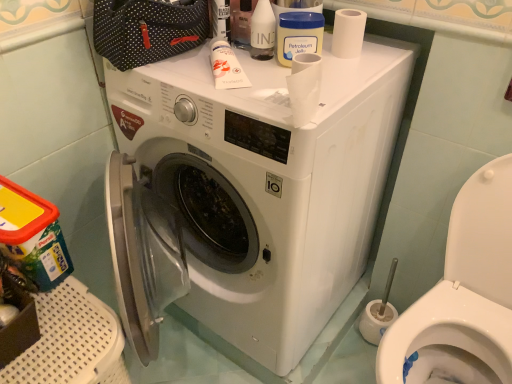
You are a GUI agent. You are given a task and a screenshot of the screen. Output one action in this format:
    pyautogui.click(x=<x>, y=<y>)
    Task: Click on the white plastic washing machine at center
    The height and width of the screenshot is (384, 512).
    Given the screenshot: What is the action you would take?
    pyautogui.click(x=267, y=184)

I want to click on white plastic washing machine at center, so click(x=267, y=184).

From the image's perspective, is white matte tube at upper center, the 2th toiletry when ordered from top to bottom, located above or below white glossy toilet at lower right?

white matte tube at upper center, the 2th toiletry when ordered from top to bottom, is situated higher than white glossy toilet at lower right in the image.

Would you consider white matte tube at upper center, which is the first toiletry from left to right, to be distant from white glossy toilet at lower right?

white matte tube at upper center, which is the first toiletry from left to right, is near white glossy toilet at lower right, not far away.

Looking at this image, from a real-world perspective, which is physically below, white matte tube at upper center, which is the 2th toiletry from right to left, or white glossy toilet at lower right?

From a 3D spatial view, white glossy toilet at lower right is below.

Considering the relative positions of white matte tube at upper center, which is the 2th toiletry from right to left, and white glossy toilet at lower right in the image provided, is white matte tube at upper center, which is the 2th toiletry from right to left, to the right of white glossy toilet at lower right from the viewer's perspective?

No.

Is point (356, 190) closer or farther from the camera than point (221, 61)?

Point (356, 190) is farther from the camera than point (221, 61).

From the picture: Is white plastic washing machine at center turned away from white matte tube at upper center, the 2th toiletry when ordered from top to bottom?

No, white plastic washing machine at center's orientation is not away from white matte tube at upper center, the 2th toiletry when ordered from top to bottom.

From their relative heights in the image, would you say white plastic washing machine at center is taller or shorter than white matte toilet paper at upper right?

In the image, white plastic washing machine at center appears to be taller than white matte toilet paper at upper right.

From a real-world perspective, relative to white matte toilet paper at upper right, is white plastic washing machine at center vertically above or below?

white plastic washing machine at center is below white matte toilet paper at upper right.

From the image's perspective, is white plastic washing machine at center over white matte toilet paper at upper right?

No, from the image's perspective, white plastic washing machine at center is not on top of white matte toilet paper at upper right.

Are white plastic washing machine at center and white matte toilet paper at upper right making contact?

white plastic washing machine at center and white matte toilet paper at upper right are not in contact.

Is point (323, 41) positioned before point (482, 364)?

Yes, point (323, 41) is closer to viewer.

Measure the distance between white plastic washing machine at center and white glossy toilet at lower right.

white plastic washing machine at center and white glossy toilet at lower right are 16.26 inches apart.

Considering the sizes of objects white plastic washing machine at center and white glossy toilet at lower right in the image provided, who is thinner, white plastic washing machine at center or white glossy toilet at lower right?

With smaller width is white glossy toilet at lower right.

Is white plastic washing machine at center spatially inside white glossy toilet at lower right, or outside of it?

white plastic washing machine at center is not enclosed by white glossy toilet at lower right.

Can you see white matte toilet paper at upper right touching white matte tube at upper center, which is the first toiletry from left to right?

No, white matte toilet paper at upper right is not making contact with white matte tube at upper center, which is the first toiletry from left to right.

Which object is more forward, white matte toilet paper at upper right or white matte tube at upper center, the 1th toiletry ordered from the bottom?

white matte tube at upper center, the 1th toiletry ordered from the bottom, is more forward.

From a real-world perspective, who is located higher, white matte toilet paper at upper right or white matte tube at upper center, the 1th toiletry ordered from the bottom?

white matte toilet paper at upper right.

Is white matte toilet paper at upper right oriented away from white matte tube at upper center, the 2th toiletry when ordered from top to bottom?

No, white matte tube at upper center, the 2th toiletry when ordered from top to bottom, is not at the back of white matte toilet paper at upper right.

Between white matte tube at upper center, the 2th toiletry when ordered from top to bottom, and translucent plastic bottle at upper center, which ranks as the first toiletry in right-to-left order, which one has smaller width?

Thinner between the two is translucent plastic bottle at upper center, which ranks as the first toiletry in right-to-left order.

From the image's perspective, who appears lower, white matte tube at upper center, which is the first toiletry from left to right, or translucent plastic bottle at upper center, which ranks as the first toiletry in right-to-left order?

From the image's view, white matte tube at upper center, which is the first toiletry from left to right, is below.

Is white matte tube at upper center, the 1th toiletry ordered from the bottom, at the right side of translucent plastic bottle at upper center, acting as the second toiletry starting from the left?

In fact, white matte tube at upper center, the 1th toiletry ordered from the bottom, is to the left of translucent plastic bottle at upper center, acting as the second toiletry starting from the left.

Measure the distance from white matte tube at upper center, which is the first toiletry from left to right, to translucent plastic bottle at upper center, which appears as the 1th toiletry when viewed from the top.

white matte tube at upper center, which is the first toiletry from left to right, is 4.35 inches from translucent plastic bottle at upper center, which appears as the 1th toiletry when viewed from the top.

Is translucent plastic bottle at upper center, the 2th toiletry in the bottom-to-top sequence, completely or partially outside of white plastic washing machine at center?

translucent plastic bottle at upper center, the 2th toiletry in the bottom-to-top sequence, is positioned outside white plastic washing machine at center.

Between translucent plastic bottle at upper center, the 2th toiletry in the bottom-to-top sequence, and white plastic washing machine at center, which one has more height?

white plastic washing machine at center.

Which is in front, translucent plastic bottle at upper center, the 2th toiletry in the bottom-to-top sequence, or white plastic washing machine at center?

white plastic washing machine at center is more forward.

You are a GUI agent. You are given a task and a screenshot of the screen. Output one action in this format:
    pyautogui.click(x=<x>, y=<y>)
    Task: Click on the washing machine in front of the translucent plastic bottle at upper center, the 2th toiletry in the bottom-to-top sequence
    Image resolution: width=512 pixels, height=384 pixels.
    Given the screenshot: What is the action you would take?
    pyautogui.click(x=267, y=184)

Where is `toiletry that is the 1st one above the white glossy toilet at lower right (from a real-world perspective)`? The image size is (512, 384). toiletry that is the 1st one above the white glossy toilet at lower right (from a real-world perspective) is located at coordinates (226, 66).

Where is `washing machine that is on the right side of white matte tube at upper center, the 1th toiletry ordered from the bottom`? This screenshot has width=512, height=384. washing machine that is on the right side of white matte tube at upper center, the 1th toiletry ordered from the bottom is located at coordinates (267, 184).

Estimate the real-world distances between objects in this image. Which object is closer to white matte tube at upper center, which is the first toiletry from left to right, white plastic washing machine at center or white matte toilet paper at upper right?

Based on the image, white matte toilet paper at upper right appears to be nearer to white matte tube at upper center, which is the first toiletry from left to right.

Which object lies further to the anchor point white glossy toilet at lower right, white matte tube at upper center, which is the first toiletry from left to right, or translucent plastic bottle at upper center, which appears as the 1th toiletry when viewed from the top?

translucent plastic bottle at upper center, which appears as the 1th toiletry when viewed from the top, is further to white glossy toilet at lower right.

Estimate the real-world distances between objects in this image. Which object is closer to white matte toilet paper at upper right, white glossy toilet at lower right or white matte tube at upper center, the 1th toiletry ordered from the bottom?

The object closer to white matte toilet paper at upper right is white matte tube at upper center, the 1th toiletry ordered from the bottom.

Estimate the real-world distances between objects in this image. Which object is further from white plastic washing machine at center, white glossy toilet at lower right or translucent plastic bottle at upper center, which ranks as the first toiletry in right-to-left order?

The object further to white plastic washing machine at center is translucent plastic bottle at upper center, which ranks as the first toiletry in right-to-left order.

Considering their positions, is translucent plastic bottle at upper center, which appears as the 1th toiletry when viewed from the top, positioned further to white matte toilet paper at upper right than white matte tube at upper center, the 2th toiletry when ordered from top to bottom?

white matte tube at upper center, the 2th toiletry when ordered from top to bottom, is further to white matte toilet paper at upper right.

From the image, which object appears to be farther from white matte tube at upper center, which is the 2th toiletry from right to left, white glossy toilet at lower right or white matte toilet paper at upper right?

The object further to white matte tube at upper center, which is the 2th toiletry from right to left, is white glossy toilet at lower right.

When comparing their distances from white glossy toilet at lower right, does translucent plastic bottle at upper center, the 2th toiletry in the bottom-to-top sequence, or white plastic washing machine at center seem closer?

white plastic washing machine at center is closer to white glossy toilet at lower right.

Considering their positions, is white matte tube at upper center, which is the first toiletry from left to right, positioned closer to translucent plastic bottle at upper center, acting as the second toiletry starting from the left, than white plastic washing machine at center?

white matte tube at upper center, which is the first toiletry from left to right.

Locate an element on the screen. The height and width of the screenshot is (384, 512). toiletry between white matte toilet paper at upper right and white glossy toilet at lower right from top to bottom is located at coordinates (226, 66).

Find the location of a particular element. The width and height of the screenshot is (512, 384). toilet paper between translucent plastic bottle at upper center, the 2th toiletry in the bottom-to-top sequence, and white glossy toilet at lower right vertically is located at coordinates (348, 33).

Find the location of a particular element. The height and width of the screenshot is (384, 512). washing machine between translucent plastic bottle at upper center, the 2th toiletry in the bottom-to-top sequence, and white glossy toilet at lower right from top to bottom is located at coordinates (267, 184).

Locate an element on the screen. toilet paper between translucent plastic bottle at upper center, which ranks as the first toiletry in right-to-left order, and white plastic washing machine at center in the up-down direction is located at coordinates (348, 33).